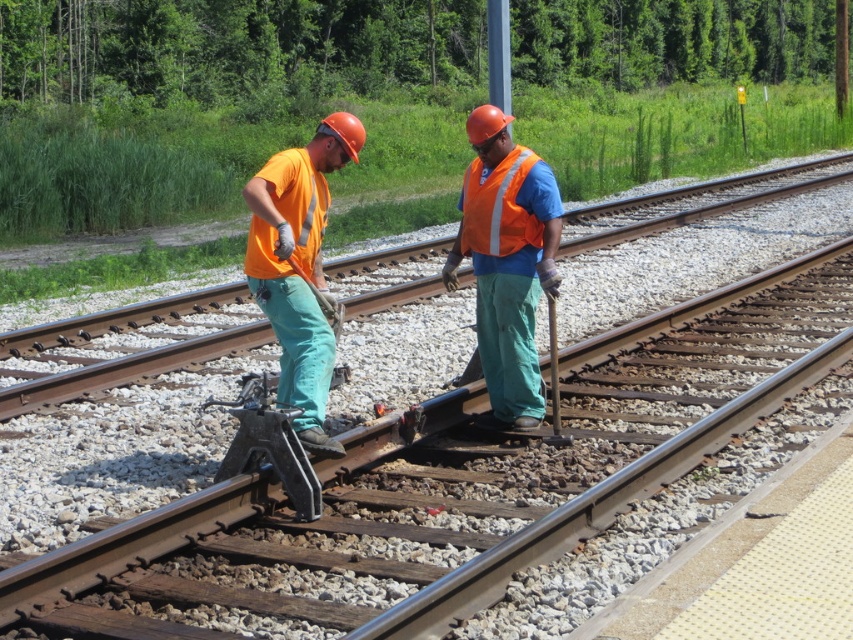
Is point (335, 168) in front of point (512, 161)?

Yes, it is.

Is matte orange shirt at center closer to the viewer compared to reflective orange safety vest at center?

Yes, matte orange shirt at center is in front of reflective orange safety vest at center.

Which is behind, point (323, 148) or point (476, 220)?

Point (476, 220)

Image resolution: width=853 pixels, height=640 pixels. I want to click on matte orange shirt at center, so click(x=299, y=266).

Is point (492, 404) in front of point (467, 172)?

No, (492, 404) is behind (467, 172).

Between orange reflective vest at center and reflective orange safety vest at center, which one has more height?

With more height is reflective orange safety vest at center.

Is point (524, 406) farther from viewer compared to point (467, 182)?

No.

At what (x,y) coordinates should I click in order to perform the action: click on orange reflective vest at center. Please return your answer as a coordinate pair (x, y). Looking at the image, I should click on (508, 260).

Is point (485, 257) positioned before point (302, 289)?

No, (485, 257) is behind (302, 289).

In the scene shown: Who is positioned more to the right, orange reflective vest at center or matte orange shirt at center?

orange reflective vest at center

In the scene shown: Who is more distant from viewer, (x=489, y=332) or (x=358, y=147)?

Positioned behind is point (x=489, y=332).

The height and width of the screenshot is (640, 853). I want to click on orange reflective vest at center, so click(x=508, y=260).